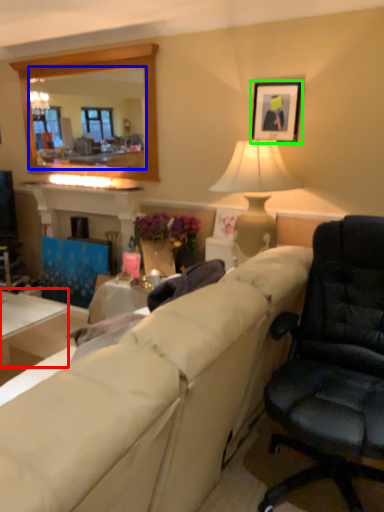
Question: Which object is the closest to the table (highlighted by a red box)? Choose among these: mirror (highlighted by a blue box) or picture frame (highlighted by a green box).

Choices:
 (A) mirror
 (B) picture frame

Answer: (B)